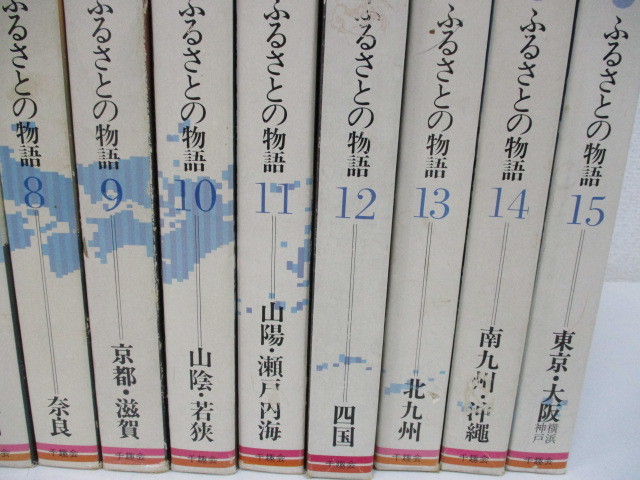
Image resolution: width=640 pixels, height=480 pixels. Identify the location of book 13. click(x=424, y=232).